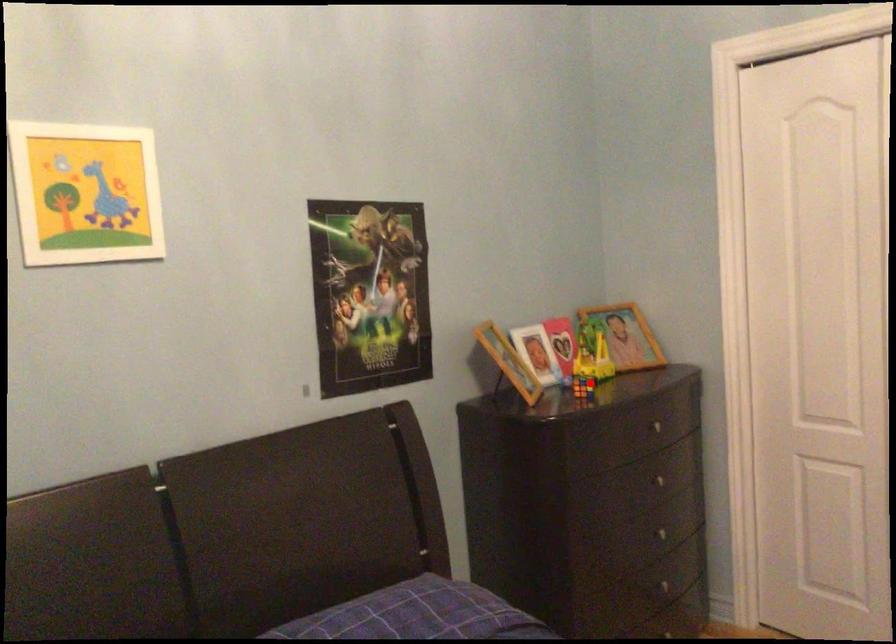
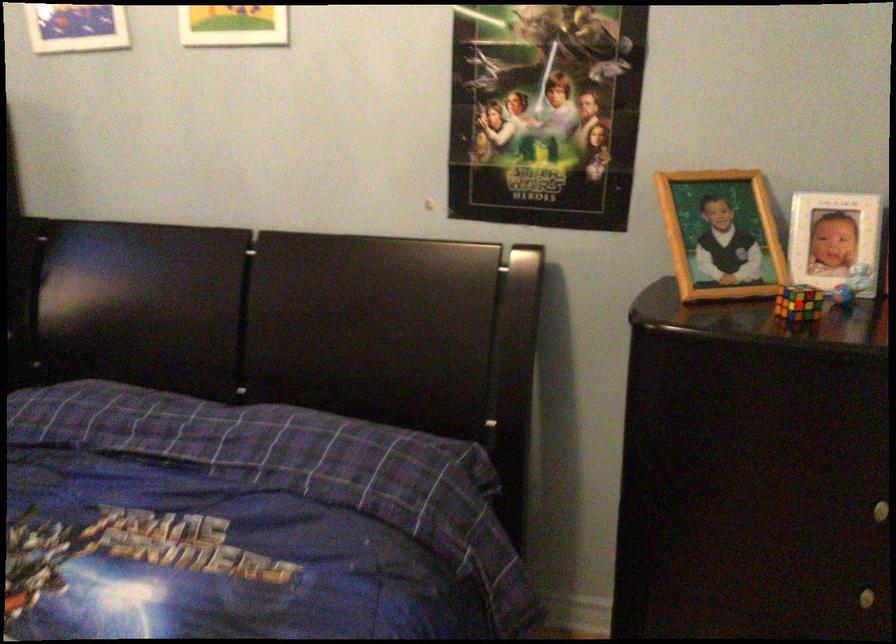
I am providing you with two images of the same scene from different viewpoints. A red point is marked on the first image and another point is marked on the second image. Is the marked point in image1 the same physical position as the marked point in image2?

Yes